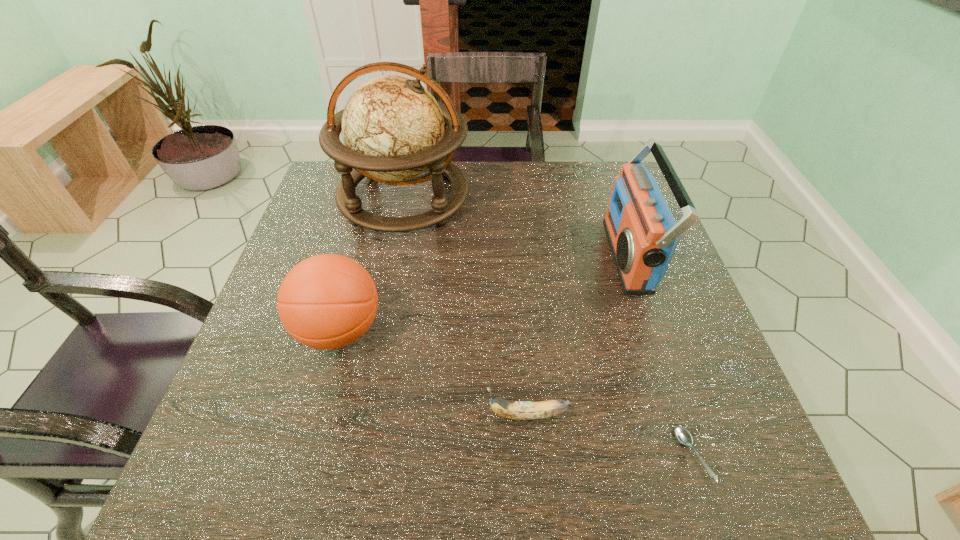
Identify the location of globe. The width and height of the screenshot is (960, 540). (394, 130).

This screenshot has height=540, width=960. I want to click on the second tallest object, so click(x=642, y=233).

Identify the location of basketball. The height and width of the screenshot is (540, 960). (328, 301).

Where is `the third object from left to right`? the third object from left to right is located at coordinates (518, 410).

I want to click on banana, so click(x=518, y=410).

This screenshot has height=540, width=960. In order to click on soupspoon in this screenshot , I will do `click(683, 436)`.

Locate an element on the screen. This screenshot has height=540, width=960. the nearest object is located at coordinates (683, 436).

Where is `free space located 0.210m on the right of the tallest object`? This screenshot has width=960, height=540. free space located 0.210m on the right of the tallest object is located at coordinates pos(543,198).

Where is `free space located on the front-facing side of the radio receiver`? free space located on the front-facing side of the radio receiver is located at coordinates (474, 255).

Locate an element on the screen. vacant space situated on the front-facing side of the radio receiver is located at coordinates (470, 255).